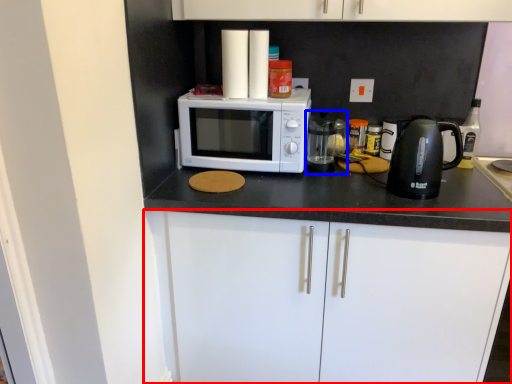
Question: Which object appears closest to the camera in this image, cabinetry (highlighted by a red box) or appliance (highlighted by a blue box)?

Choices:
 (A) cabinetry
 (B) appliance

Answer: (A)